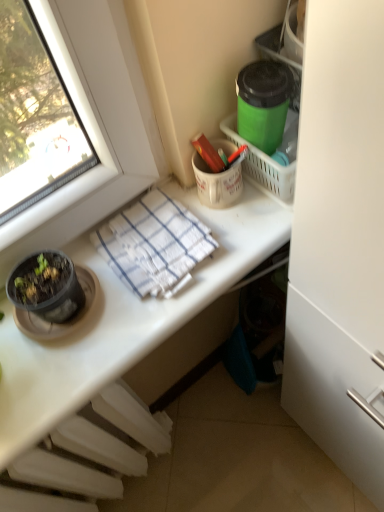
I want to click on vacant space to the right of white woven towel at center, so click(242, 225).